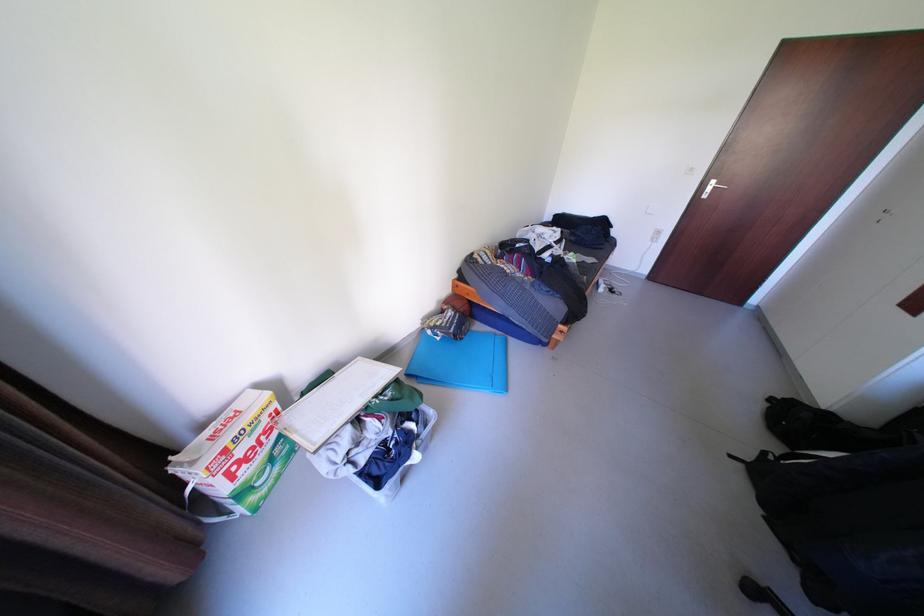
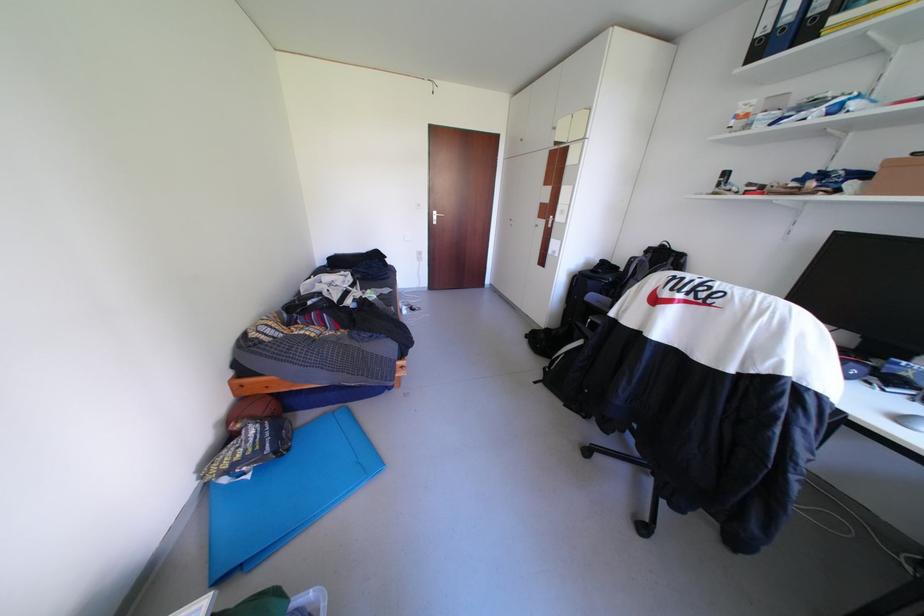
Question: How did the camera likely rotate?

Choices:
 (A) Left
 (B) Right
 (C) Up
 (D) Down

Answer: (B)